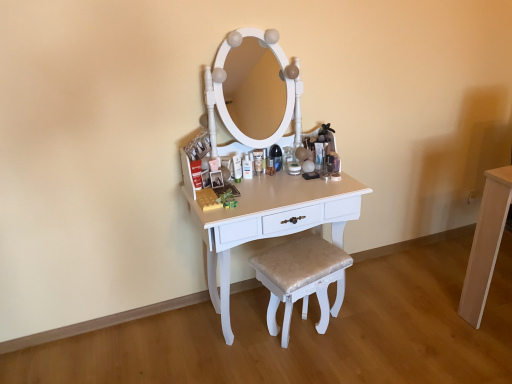
What are the coordinates of `vacant space situated on the left part of white glossy table at center, which appears as the 1th table when viewed from the left` in the screenshot? It's located at (161, 347).